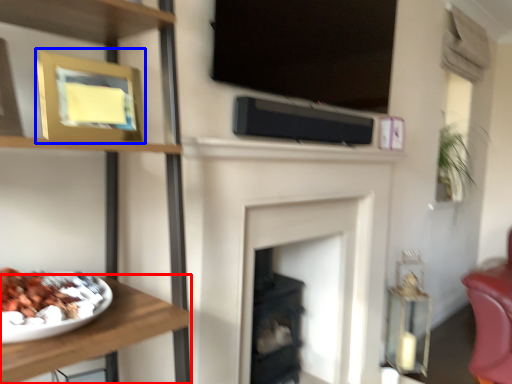
Question: Which point is further to the camera, furniture (highlighted by a red box) or picture frame (highlighted by a blue box)?

Choices:
 (A) furniture
 (B) picture frame

Answer: (B)